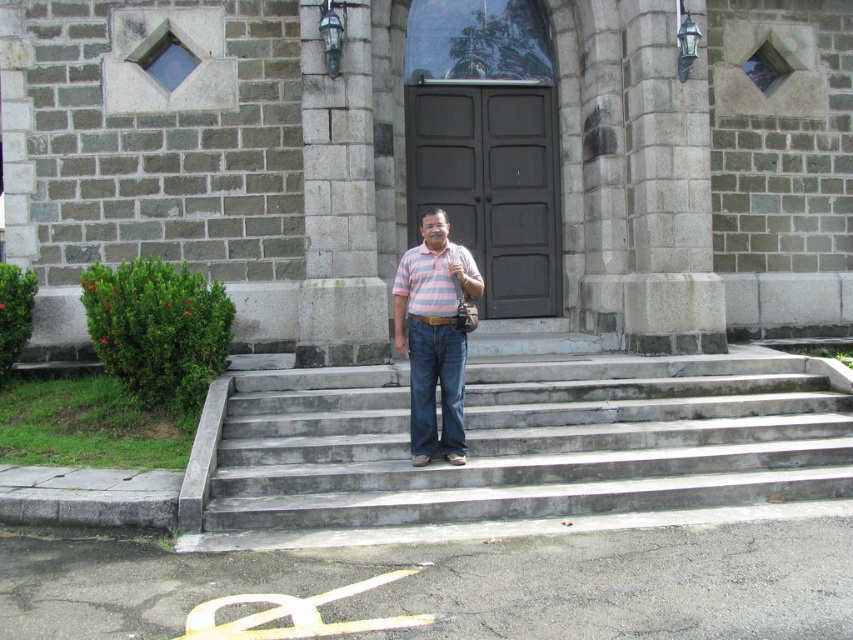
You are a fashion designer analyzing the outfit of a tourist in the image. The tourist is wearing a pink striped polo shirt at center and dark blue denim jeans at center. Which clothing item is positioned to the right of the other?

The dark blue denim jeans at center is positioned on the right side of pink striped polo shirt at center.

You are trying to locate the dark blue denim jeans in the image. According to the coordinates provided, where exactly is the dark blue denim jeans at center positioned?

The dark blue denim jeans at center is located at point coordinates of 0.605 on the x axis and 0.510 on the y axis.

You are a fashion designer observing the man on the stone steps. You notice two pink striped shirts on him. Which one is closer to you, the pink striped shirt at center or the pink striped polo shirt at center?

The pink striped shirt at center is closer to you because it is in front of the pink striped polo shirt at center.